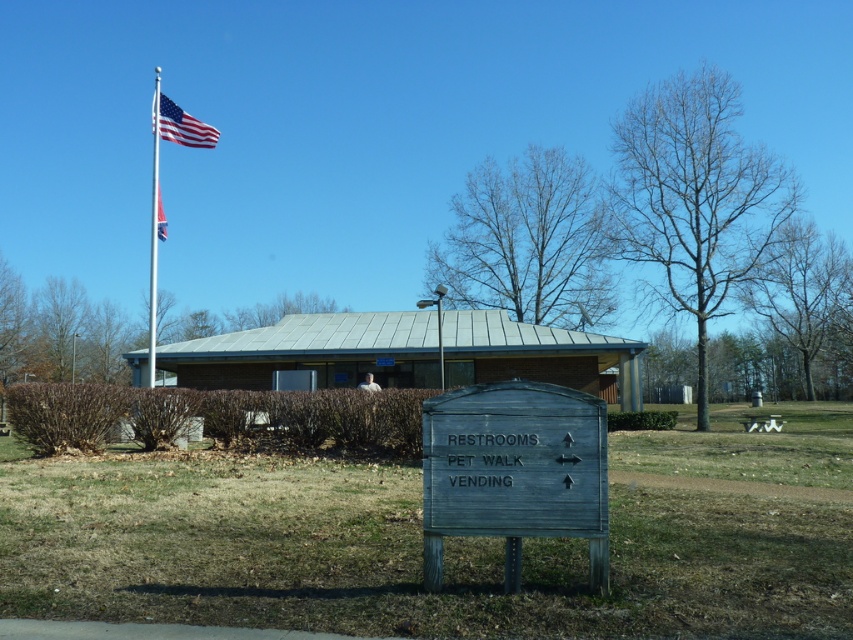
Does point (454, 460) come closer to viewer compared to point (155, 129)?

That is True.

Locate an element on the screen. The image size is (853, 640). weathered wood sign at center is located at coordinates (514, 472).

The height and width of the screenshot is (640, 853). In order to click on weathered wood sign at center in this screenshot , I will do `click(514, 472)`.

Does polished metallic flag at upper center have a smaller size compared to american flag at upper left?

No.

Does polished metallic flag at upper center have a lesser height compared to american flag at upper left?

No, polished metallic flag at upper center is not shorter than american flag at upper left.

Find the location of a particular element. The width and height of the screenshot is (853, 640). polished metallic flag at upper center is located at coordinates (180, 124).

Does weathered wood sign at center appear on the right side of metallic flag pole at upper left?

Yes, weathered wood sign at center is to the right of metallic flag pole at upper left.

Between weathered wood sign at center and metallic flag pole at upper left, which one appears on the left side from the viewer's perspective?

Positioned to the left is metallic flag pole at upper left.

Is point (508, 384) closer to viewer compared to point (151, 282)?

That is True.

Find the location of a particular element. weathered wood sign at center is located at coordinates (514, 472).